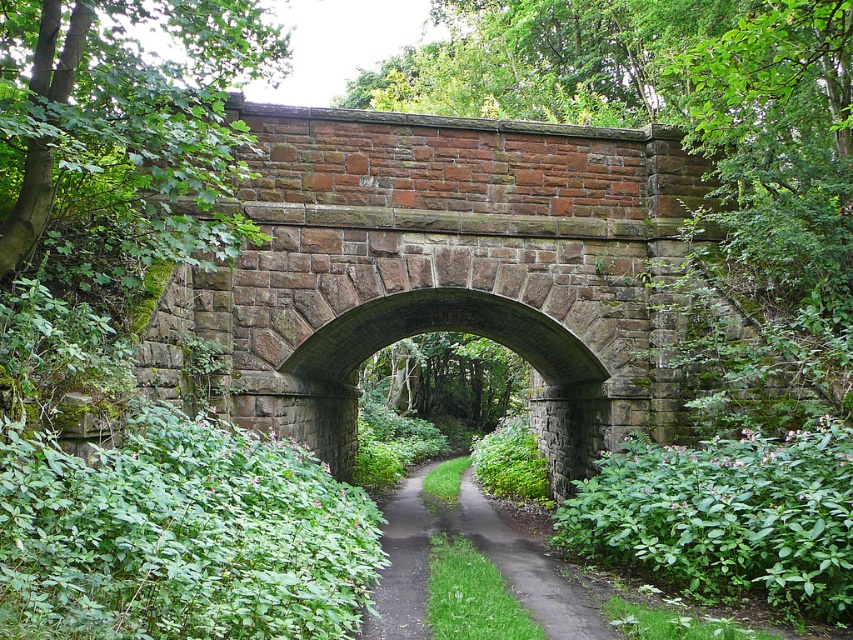
You are standing at the center of the rustic stone bridge and notice a green leafy bush at lower left. Based on its position, can you determine if it is closer to you or further away compared to the bridge?

The green leafy bush at lower left is located at point (x=180, y=536), which places it further away from the observer compared to the bridge structure itself.

You are a gardener planning to trim the green leafy bush at lower left and the dull gray asphalt path at center. Since you need to know which one is wider, can you determine which object has a greater width?

The green leafy bush at lower left has a greater width than the dull gray asphalt path at center.